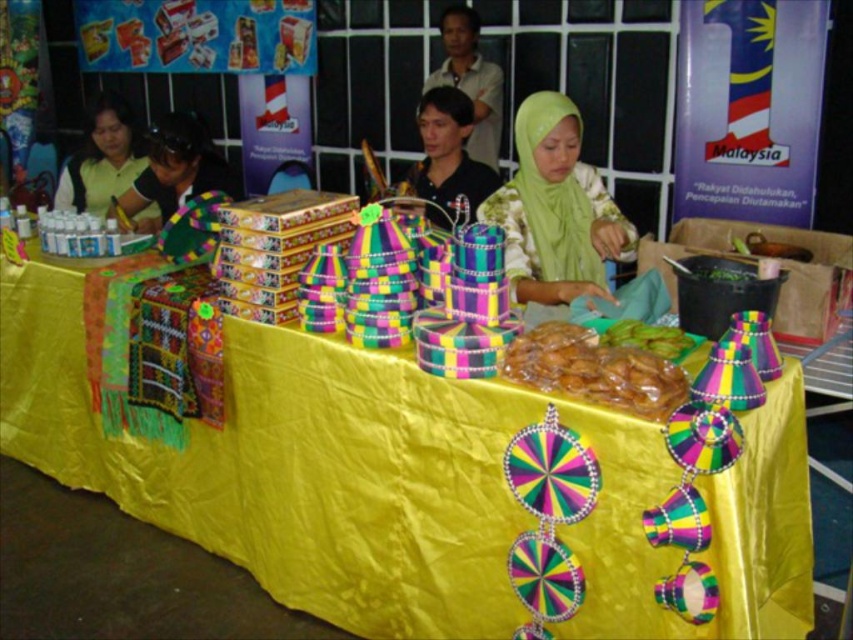
Question: Can you confirm if translucent plastic bag at center is positioned to the left of matte yellow shirt at upper left?

Choices:
 (A) no
 (B) yes

Answer: (A)

Question: Considering the real-world distances, which object is closest to the yellow fabric table at center?

Choices:
 (A) translucent plastic bag at center
 (B) matte yellow shirt at upper left
 (C) green fabric hijab at center
 (D) black fabric headscarf at upper left

Answer: (A)

Question: Which is nearer to the translucent plastic bag at center?

Choices:
 (A) green fabric hijab at center
 (B) matte yellow shirt at upper left

Answer: (A)

Question: Is yellow fabric table at center further to the viewer compared to matte yellow shirt at upper left?

Choices:
 (A) no
 (B) yes

Answer: (A)

Question: Which of these objects is positioned farthest from the yellow fabric table at center?

Choices:
 (A) matte yellow shirt at upper left
 (B) green fabric hijab at center
 (C) black fabric headscarf at upper left
 (D) translucent plastic bag at center

Answer: (A)

Question: Considering the relative positions of yellow fabric table at center and black fabric headscarf at upper left in the image provided, where is yellow fabric table at center located with respect to black fabric headscarf at upper left?

Choices:
 (A) left
 (B) right

Answer: (B)